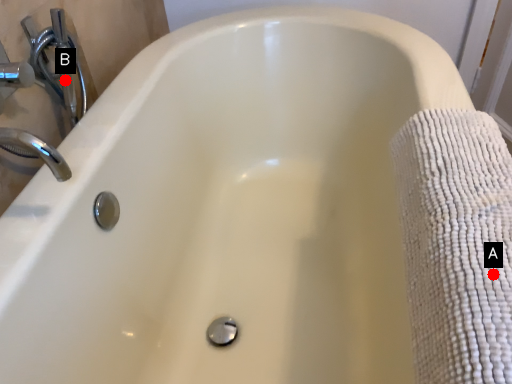
Question: Two points are circled on the image, labeled by A and B beside each circle. Which point is closer to the camera?

Choices:
 (A) A is closer
 (B) B is closer

Answer: (A)